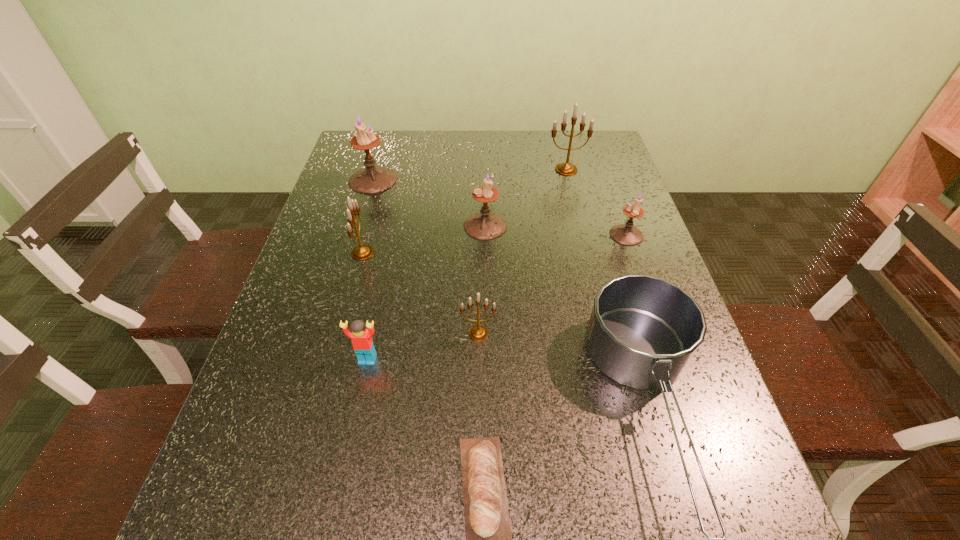
Locate an element on the screen. The width and height of the screenshot is (960, 540). the nearest gold candelabrum is located at coordinates (478, 332).

Identify the location of Lego. (362, 342).

This screenshot has width=960, height=540. I want to click on free space located on the right of the farthest purple candle holder, so click(x=420, y=180).

Locate an element on the screen. vacant space located on the left of the fifth candelabrum from left to right is located at coordinates (497, 170).

What are the coordinates of `vacant space located on the right of the second purple candle holder from right to left` in the screenshot? It's located at (549, 226).

Where is `free location located 0.060m on the back of the second biggest gold candelabrum`? The image size is (960, 540). free location located 0.060m on the back of the second biggest gold candelabrum is located at coordinates (370, 225).

The height and width of the screenshot is (540, 960). What are the coordinates of `blank space located 0.290m on the back of the rightmost purple candle holder` in the screenshot? It's located at (602, 165).

You are a GUI agent. You are given a task and a screenshot of the screen. Output one action in this format:
    pyautogui.click(x=<x>, y=<y>)
    Task: Click on the vacant space situated on the left of the smallest gold candelabrum
    Image resolution: width=960 pixels, height=540 pixels.
    Given the screenshot: What is the action you would take?
    pyautogui.click(x=340, y=333)

At what (x,y) coordinates should I click in order to perform the action: click on vacant region located on the face of the Lego. Please return your answer as a coordinate pair (x, y). The image size is (960, 540). Looking at the image, I should click on (356, 414).

Where is `object that is at the far left corner`? object that is at the far left corner is located at coordinates (372, 179).